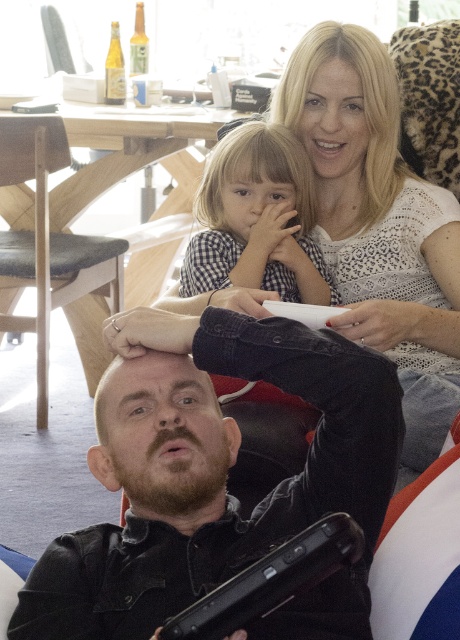
Is the position of checkered fabric dress at center less distant than that of light brown wooden chair at left?

Yes, checkered fabric dress at center is in front of light brown wooden chair at left.

Is point (246, 124) less distant than point (49, 269)?

That is True.

You are a GUI agent. You are given a task and a screenshot of the screen. Output one action in this format:
    pyautogui.click(x=<x>, y=<y>)
    Task: Click on the checkered fabric dress at center
    The height and width of the screenshot is (640, 460).
    Given the screenshot: What is the action you would take?
    pyautogui.click(x=257, y=220)

Based on the photo, which is below, dark brown leather jacket at lower left or checkered fabric dress at center?

Positioned lower is dark brown leather jacket at lower left.

Does dark brown leather jacket at lower left have a smaller size compared to checkered fabric dress at center?

Incorrect, dark brown leather jacket at lower left is not smaller in size than checkered fabric dress at center.

Who is more distant from viewer, [118,568] or [211,282]?

Positioned behind is point [211,282].

At what (x,y) coordinates should I click in order to perform the action: click on dark brown leather jacket at lower left. Please return your answer as a coordinate pair (x, y). Looking at the image, I should click on (219, 484).

Is dark brown leather jacket at lower left further to the viewer compared to light brown wooden chair at left?

No.

Which is more to the right, dark brown leather jacket at lower left or light brown wooden chair at left?

From the viewer's perspective, dark brown leather jacket at lower left appears more on the right side.

Where is `dark brown leather jacket at lower left`? This screenshot has height=640, width=460. dark brown leather jacket at lower left is located at coordinates (219, 484).

Locate an element on the screen. dark brown leather jacket at lower left is located at coordinates (219, 484).